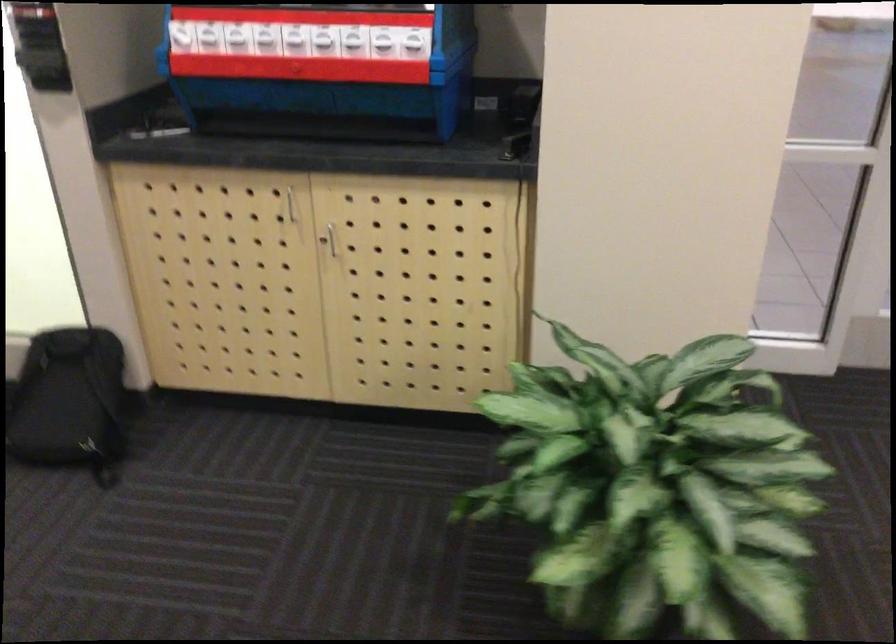
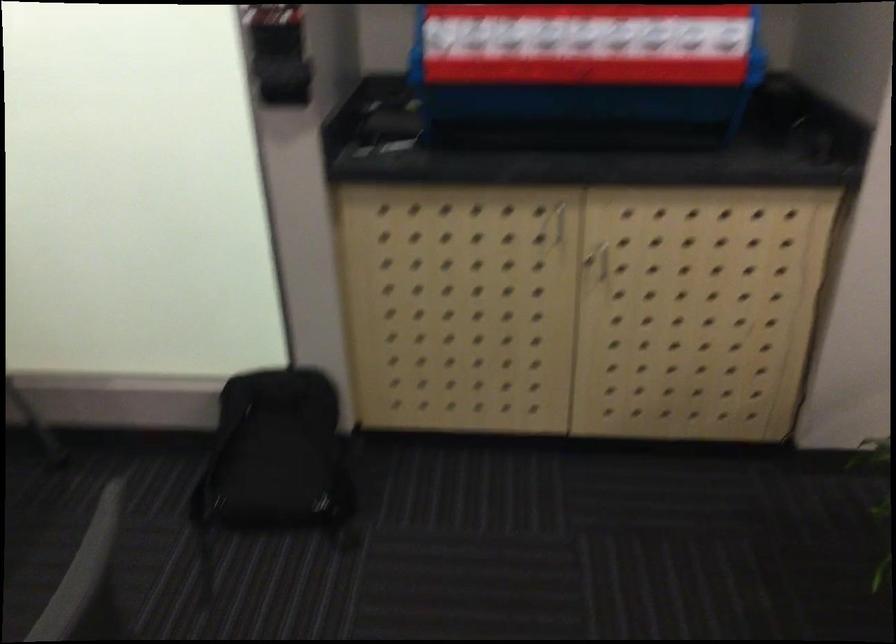
Question: The camera is either moving clockwise (left) or counter-clockwise (right) around the object. The first image is from the beginning of the video and the second image is from the end. Is the camera moving left or right when shooting the video?

Choices:
 (A) Left
 (B) Right

Answer: (A)